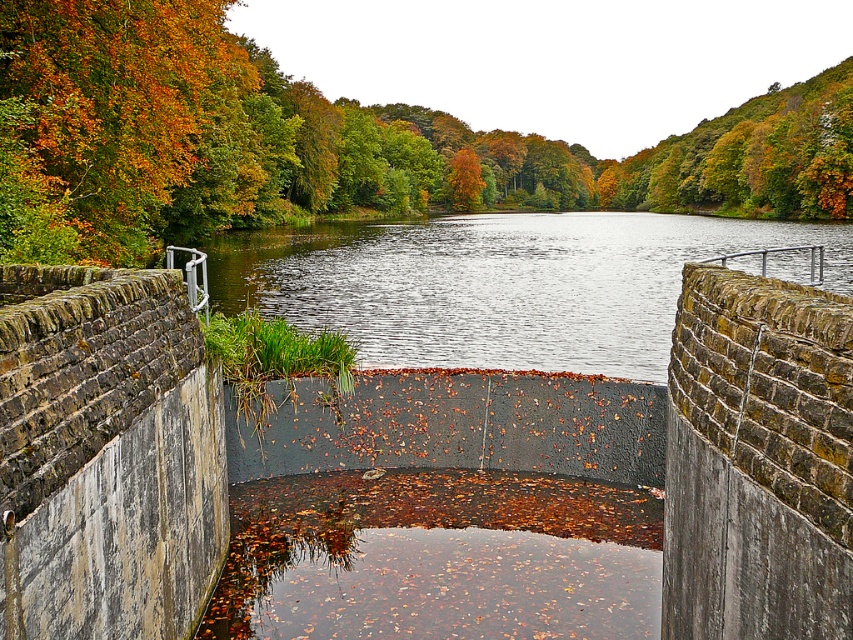
Measure the distance between autumn leaves at upper center and camera.

autumn leaves at upper center is 11.10 meters away from camera.

Which is more to the right, autumn leaves at upper center or smooth concrete river at center?

autumn leaves at upper center

Which is behind, point (97, 3) or point (316, 282)?

The point (316, 282) is behind.

The width and height of the screenshot is (853, 640). I want to click on autumn leaves at upper center, so click(x=308, y=141).

Can you confirm if autumn leaves at upper center is positioned to the left of autumn leaves at upper left?

In fact, autumn leaves at upper center is to the right of autumn leaves at upper left.

Describe the element at coordinates (308, 141) in the screenshot. I see `autumn leaves at upper center` at that location.

Who is more distant from viewer, (579,161) or (86,212)?

Point (579,161)

Where is `autumn leaves at upper center`? This screenshot has width=853, height=640. autumn leaves at upper center is located at coordinates (308, 141).

Between smooth concrete river at center and autumn leaves at upper left, which one has more height?

autumn leaves at upper left

Between smooth concrete river at center and autumn leaves at upper left, which one has less height?

smooth concrete river at center

This screenshot has width=853, height=640. What are the coordinates of `smooth concrete river at center` in the screenshot? It's located at (498, 284).

Where is `smooth concrete river at center`? This screenshot has width=853, height=640. smooth concrete river at center is located at coordinates (498, 284).